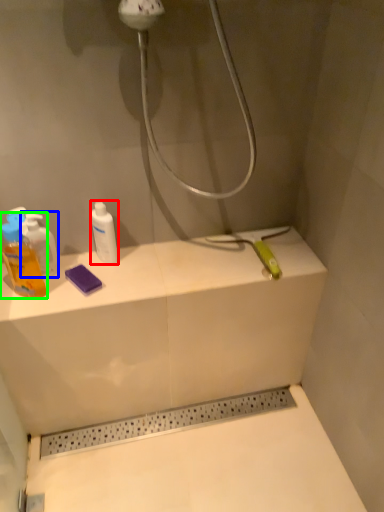
Question: Which object is the closest to the mouthwash (highlighted by a red box)? Choose among these: mouthwash (highlighted by a blue box) or mouthwash (highlighted by a green box).

Choices:
 (A) mouthwash
 (B) mouthwash

Answer: (A)